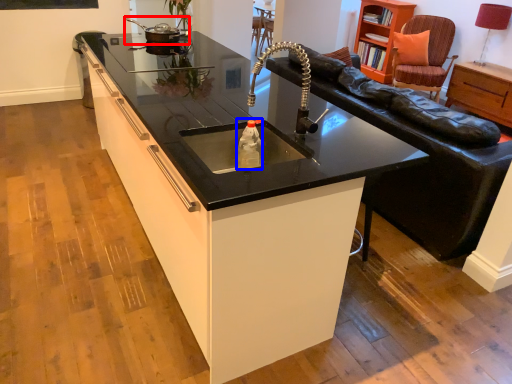
Question: Which of the following is the closest to the observer, appliance (highlighted by a red box) or bottle (highlighted by a blue box)?

Choices:
 (A) appliance
 (B) bottle

Answer: (B)